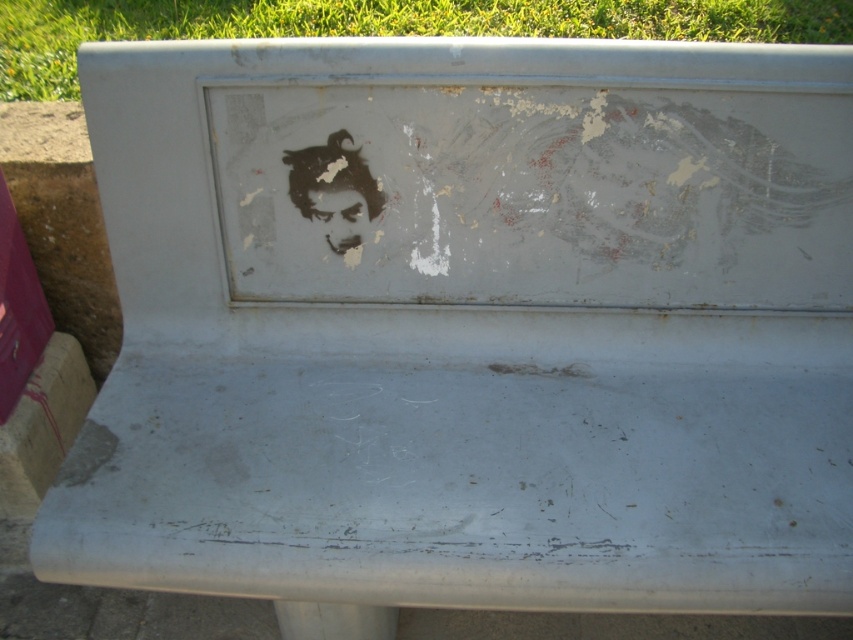
Question: Is green grass at top below matte black face at center?

Choices:
 (A) no
 (B) yes

Answer: (A)

Question: From the image, what is the correct spatial relationship of green grass at top in relation to matte black face at center?

Choices:
 (A) above
 (B) below

Answer: (A)

Question: Which point is closer to the camera taking this photo?

Choices:
 (A) (57, 4)
 (B) (352, 189)

Answer: (B)

Question: Observing the image, what is the correct spatial positioning of green grass at top in reference to matte black face at center?

Choices:
 (A) below
 (B) above

Answer: (B)

Question: Which object appears farthest from the camera in this image?

Choices:
 (A) green grass at top
 (B) matte black face at center

Answer: (A)